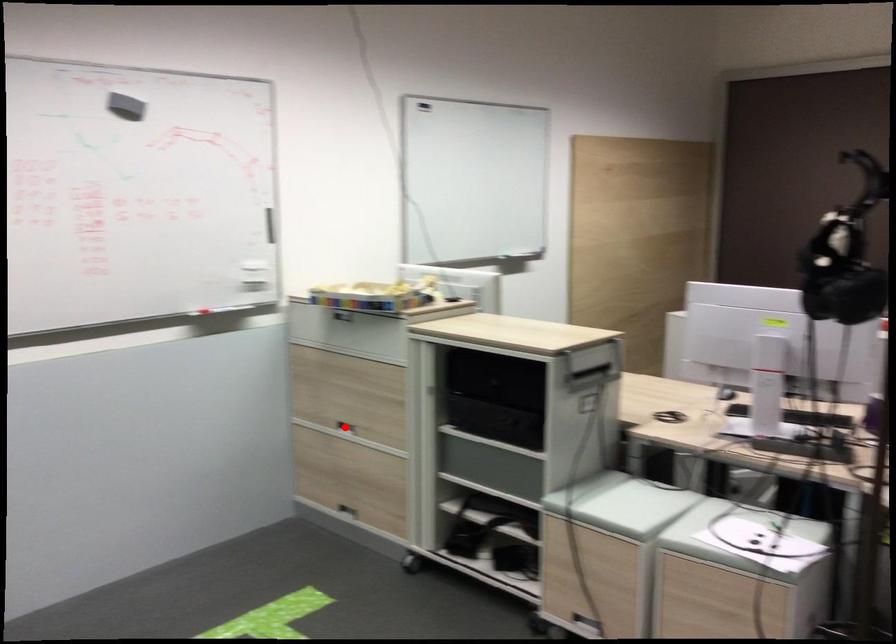
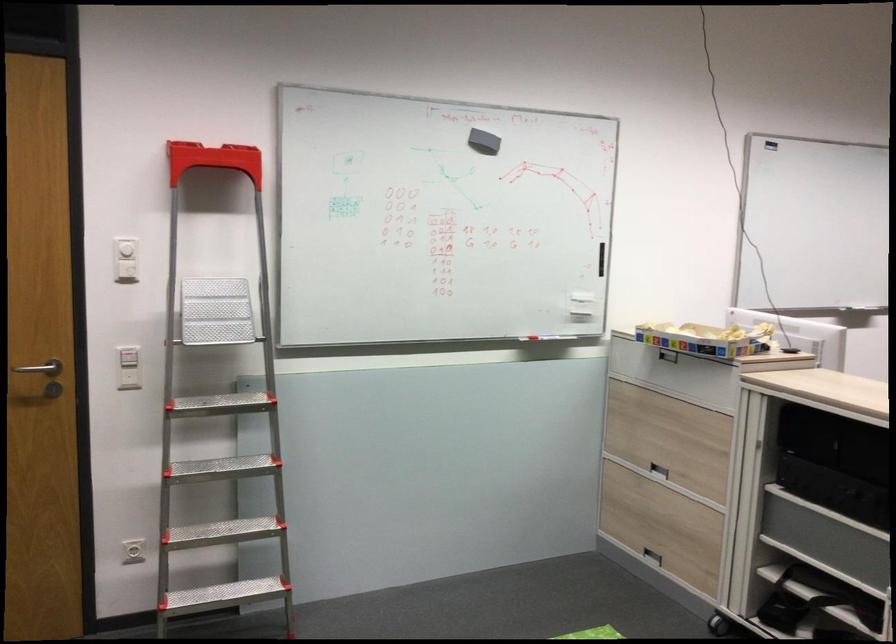
Locate, in the second image, the point that corresponds to the highlighted location in the first image.

(658, 469)